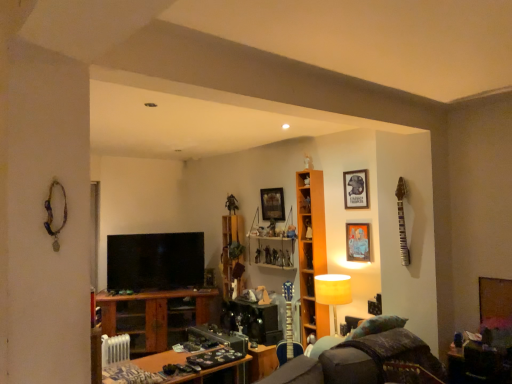
Identify the location of vacant area on top of wooden cabinet at center, the first cabinet in the back-to-front sequence (from a real-world perspective). (234, 213).